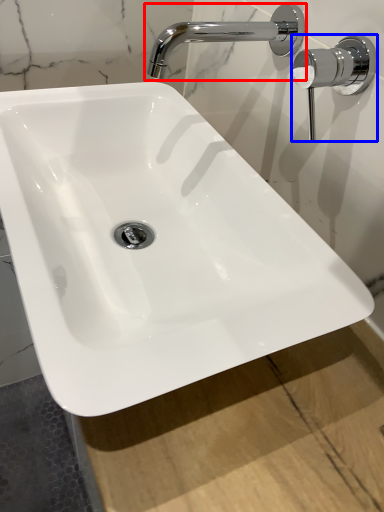
Question: Which object is further to the camera taking this photo, tap (highlighted by a red box) or door handle (highlighted by a blue box)?

Choices:
 (A) tap
 (B) door handle

Answer: (A)